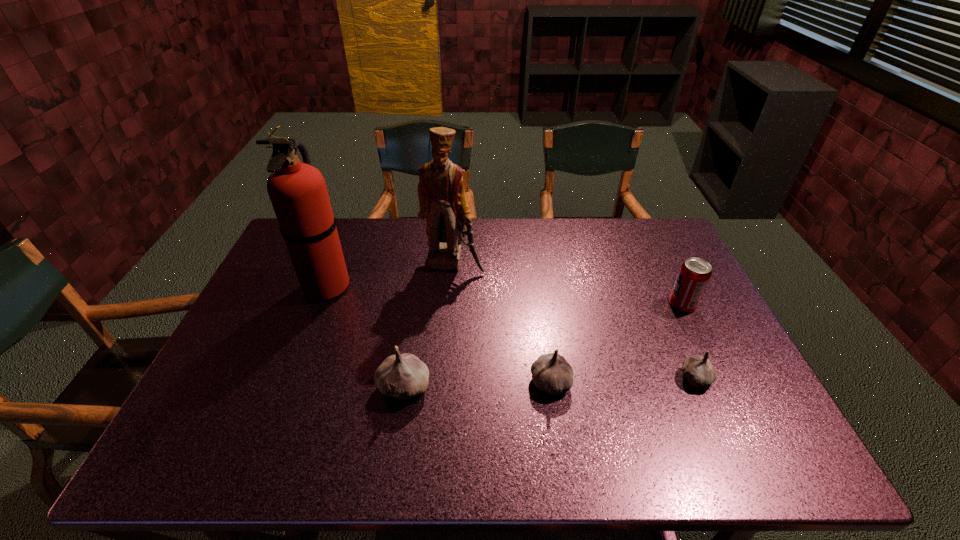
You are a GUI agent. You are given a task and a screenshot of the screen. Output one action in this format:
    pyautogui.click(x=<x>, y=<y>)
    Task: Click on the vacant space that satisfies the following two spatial constraints: 1. on the back side of the fourth object from left to right; 2. on the left side of the tallest garlic
    
    Given the screenshot: What is the action you would take?
    pyautogui.click(x=404, y=382)